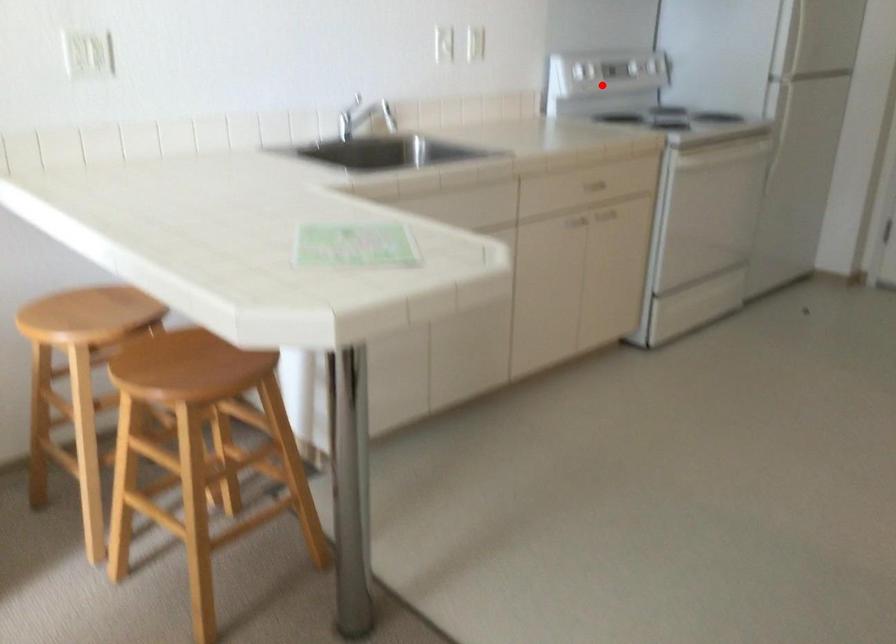
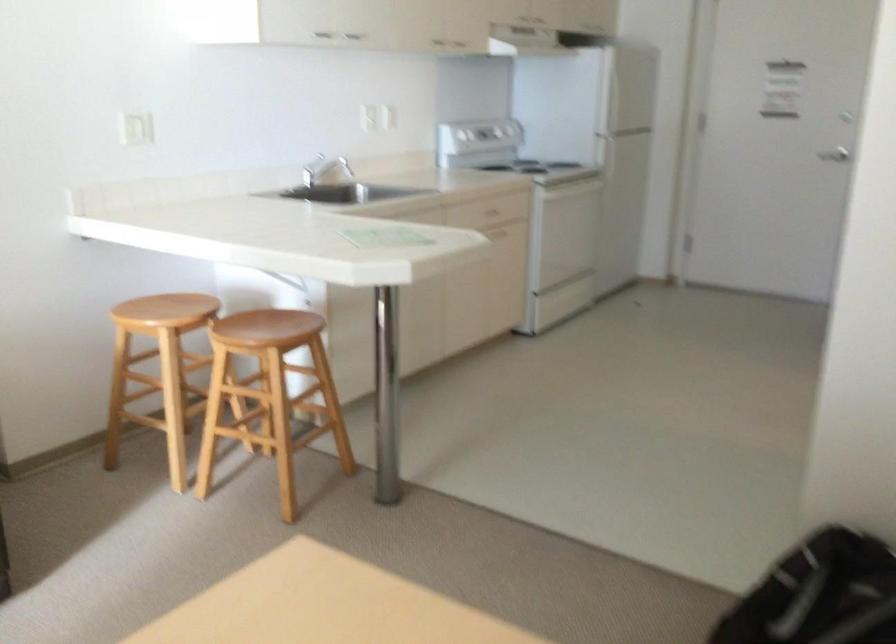
Question: I am providing you with two images of the same scene from different viewpoints. A red point is shown in image1. For the corresponding object point in image2, is it positioned nearer or farther from the camera?

Choices:
 (A) Nearer
 (B) Farther

Answer: (B)